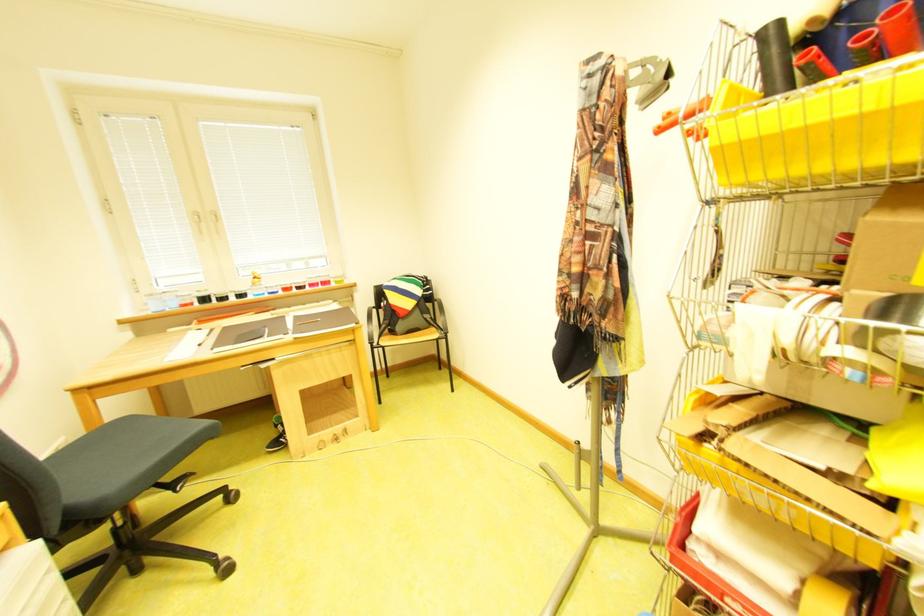
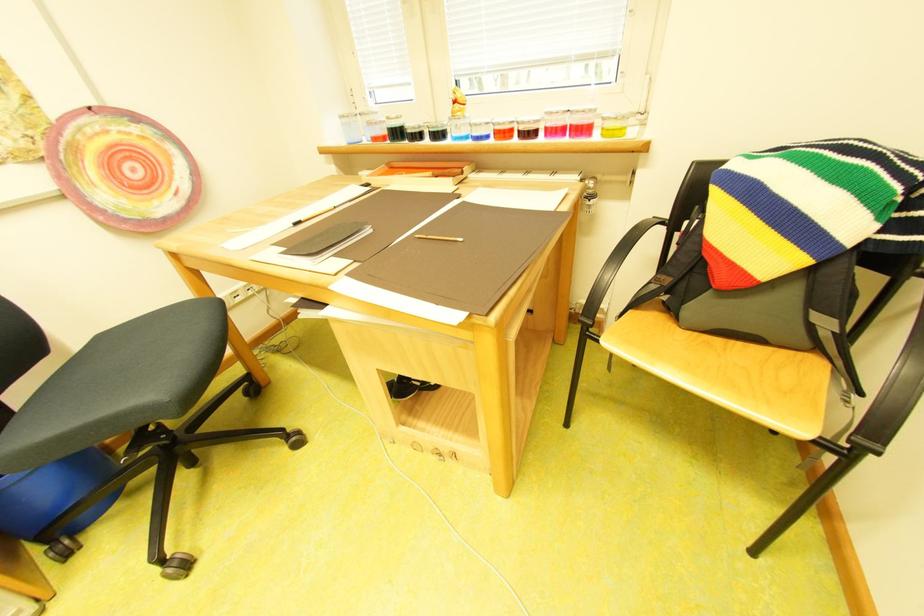
The point at (x=444, y=331) is marked in the first image. Where is the corresponding point in the second image?

(829, 367)